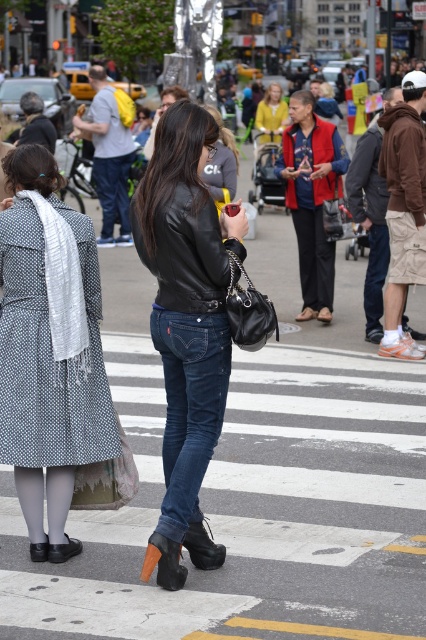
Which is below, leather jacket at center or dark blue denim jeans at center?

dark blue denim jeans at center is below.

Does leather jacket at center have a greater height compared to dark blue denim jeans at center?

Yes, leather jacket at center is taller than dark blue denim jeans at center.

Is point (195, 460) behind point (230, 344)?

No, it is not.

Where is `leather jacket at center`? This screenshot has width=426, height=640. leather jacket at center is located at coordinates (186, 326).

Who is more distant from viewer, (25, 241) or (176, 413)?

Point (176, 413)

What do you see at coordinates (49, 349) in the screenshot? Image resolution: width=426 pixels, height=640 pixels. I see `polka dot dress at center` at bounding box center [49, 349].

Find the location of a particular element. The width and height of the screenshot is (426, 640). polka dot dress at center is located at coordinates (49, 349).

Who is lower down, polka dot dress at center or leather jacket at center?

polka dot dress at center is lower down.

Based on the photo, can you confirm if polka dot dress at center is positioned below leather jacket at center?

Yes, polka dot dress at center is below leather jacket at center.

Find the location of a particular element. The image size is (426, 640). polka dot dress at center is located at coordinates (49, 349).

I want to click on polka dot dress at center, so click(x=49, y=349).